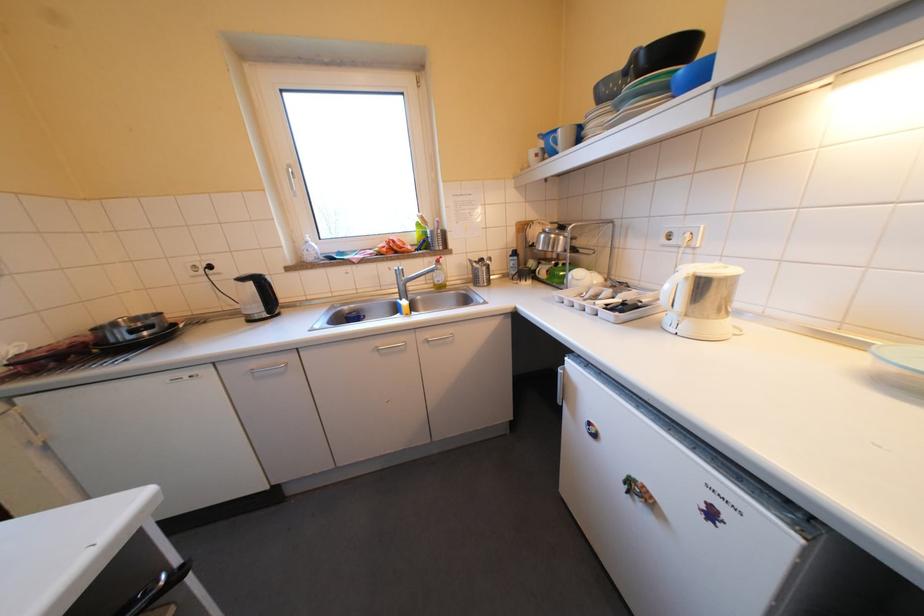
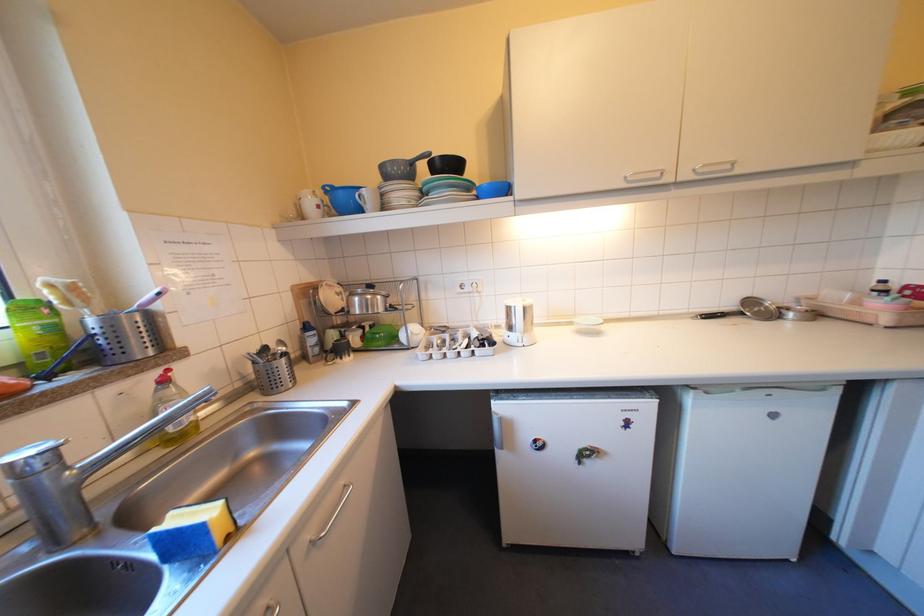
The point at (570,152) is marked in the first image. Where is the corresponding point in the second image?

(373, 209)